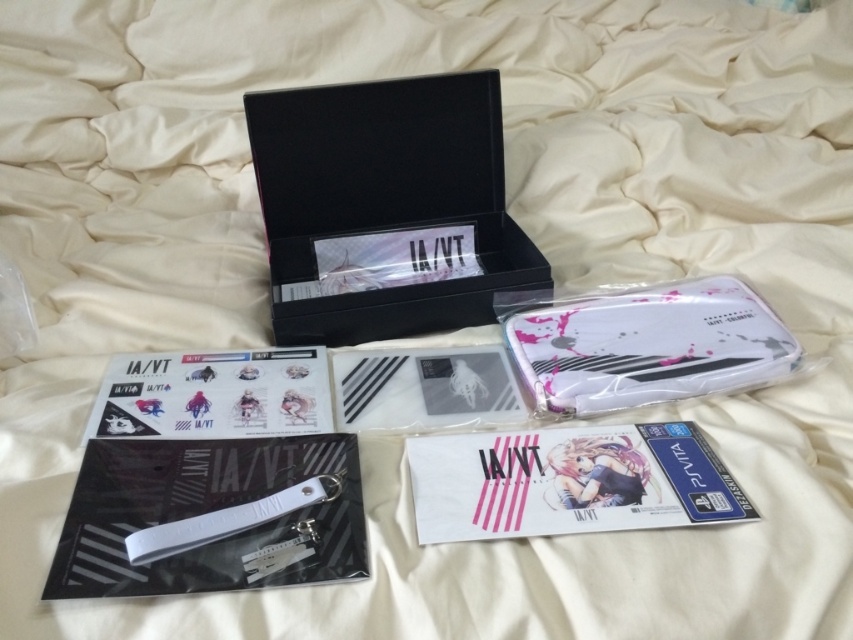
You are organizing the items on the bedsheet and need to place the black matte box at upper center and the white matte plastic case at center into a storage container. Which item should you place first to ensure proper stacking?

The black matte box at upper center should be placed first since it is above the white matte plastic case at center, indicating it is positioned higher and likely needs to be placed lower in the container to allow stacking.

You are organizing a card game set on a table. You have two card games in front of you, the white matte card game at center and the matte plastic card game at center left. According to their positions, which one is on the left side?

The matte plastic card game at center left is on the left side because it is positioned to the left of the white matte card game at center.

You are looking at the items on the bedsheet. There are two points marked on the image. One is at point (x=375, y=314) and the other is at point (x=706, y=380). Which point is closer to you?

Point (x=375, y=314) is closer to you than point (x=706, y=380) because it is further to the camera.